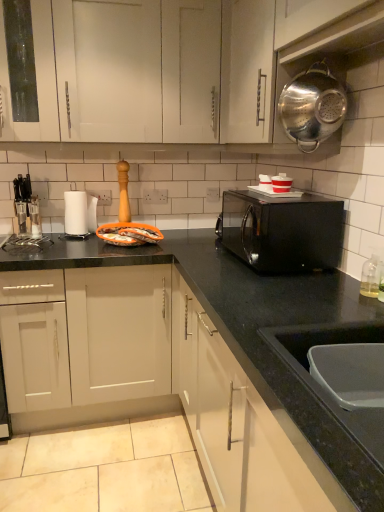
What do you see at coordinates (371, 274) in the screenshot? Image resolution: width=384 pixels, height=512 pixels. I see `clear glass soap dispenser at right` at bounding box center [371, 274].

Measure the distance between point (x=231, y=220) and camera.

Point (x=231, y=220) is 2.03 meters from camera.

At what (x,y) coordinates should I click in order to perform the action: click on polished stainless steel colander at upper right. Please return your answer as a coordinate pair (x, y). The width and height of the screenshot is (384, 512). Looking at the image, I should click on (312, 106).

Which of these two, metallic silver colander at upper right or black glossy microwave at center, is wider?

black glossy microwave at center.

Does metallic silver colander at upper right have a larger size compared to black glossy microwave at center?

Indeed, metallic silver colander at upper right has a larger size compared to black glossy microwave at center.

Could you tell me if clear glass soap dispenser at right is facing white glossy cup at upper center, which is the second appliance from left to right?

No, clear glass soap dispenser at right is not facing towards white glossy cup at upper center, which is the second appliance from left to right.

Is clear glass soap dispenser at right situated inside white glossy cup at upper center, marked as the first appliance in a right-to-left arrangement, or outside?

clear glass soap dispenser at right is not inside white glossy cup at upper center, marked as the first appliance in a right-to-left arrangement, it's outside.

Relative to white glossy cup at upper center, marked as the first appliance in a right-to-left arrangement, is clear glass soap dispenser at right in front or behind?

In the image, clear glass soap dispenser at right appears in front of white glossy cup at upper center, marked as the first appliance in a right-to-left arrangement.

Would you say clear glass soap dispenser at right is a long distance from white glossy cup at upper center, the 2th appliance viewed from the back?

clear glass soap dispenser at right is near white glossy cup at upper center, the 2th appliance viewed from the back, not far away.

Is clear glass soap dispenser at right inside or outside of polished stainless steel colander at upper right?

clear glass soap dispenser at right is spatially situated outside polished stainless steel colander at upper right.

Considering the sizes of objects clear glass soap dispenser at right and polished stainless steel colander at upper right in the image provided, who is thinner, clear glass soap dispenser at right or polished stainless steel colander at upper right?

Thinner between the two is clear glass soap dispenser at right.

Considering the sizes of objects clear glass soap dispenser at right and polished stainless steel colander at upper right in the image provided, who is smaller, clear glass soap dispenser at right or polished stainless steel colander at upper right?

clear glass soap dispenser at right.

Could you tell me if clear glass soap dispenser at right is turned towards polished stainless steel colander at upper right?

No, clear glass soap dispenser at right is not oriented towards polished stainless steel colander at upper right.

From the image's perspective, is polished stainless steel colander at upper right located beneath black glossy microwave at center?

Incorrect, from the image's perspective, polished stainless steel colander at upper right is higher than black glossy microwave at center.

Considering the positions of point (339, 123) and point (286, 210), is point (339, 123) closer or farther from the camera than point (286, 210)?

Point (339, 123) is positioned farther from the camera compared to point (286, 210).

In the scene shown: Is polished stainless steel colander at upper right spatially inside black glossy microwave at center, or outside of it?

polished stainless steel colander at upper right lies outside black glossy microwave at center.

From the image's perspective, between matte black knife block at left, the 2th appliance from the right, and black glossy microwave at center, who is located below?

black glossy microwave at center appears lower in the image.

Is matte black knife block at left, acting as the 2th appliance starting from the front, not within black glossy microwave at center?

matte black knife block at left, acting as the 2th appliance starting from the front, lies outside black glossy microwave at center's area.

Looking at this image, between matte black knife block at left, which appears as the 1th appliance when viewed from the left, and black glossy microwave at center, which one has smaller size?

With smaller size is matte black knife block at left, which appears as the 1th appliance when viewed from the left.

Looking at the image, does metallic silver colander at upper right seem bigger or smaller compared to clear glass soap dispenser at right?

metallic silver colander at upper right is bigger than clear glass soap dispenser at right.

In the scene shown: Which of these two, metallic silver colander at upper right or clear glass soap dispenser at right, stands taller?

With more height is metallic silver colander at upper right.

From a real-world perspective, which object stands above the other?

In real-world perspective, metallic silver colander at upper right is above.

Considering the positions of objects metallic silver colander at upper right and clear glass soap dispenser at right in the image provided, who is more to the left, metallic silver colander at upper right or clear glass soap dispenser at right?

metallic silver colander at upper right.

From a real-world perspective, is white glossy cup at upper center, which is the second appliance from left to right, located beneath black glossy microwave at center?

No, from a real-world perspective, white glossy cup at upper center, which is the second appliance from left to right, is not under black glossy microwave at center.

Which is behind, white glossy cup at upper center, marked as the first appliance in a right-to-left arrangement, or black glossy microwave at center?

white glossy cup at upper center, marked as the first appliance in a right-to-left arrangement.

From the image's perspective, which is below, white glossy cup at upper center, the 1th appliance in the front-to-back sequence, or black glossy microwave at center?

black glossy microwave at center appears lower in the image.

Considering the points (284, 183) and (303, 258), which point is in front, point (284, 183) or point (303, 258)?

The point (303, 258) is closer to the camera.

Identify the location of cabinetry in front of the black glossy microwave at center. The height and width of the screenshot is (512, 384). (283, 54).

Where is `bottle below the white glossy cup at upper center, the 1th appliance in the front-to-back sequence (from a real-world perspective)`? bottle below the white glossy cup at upper center, the 1th appliance in the front-to-back sequence (from a real-world perspective) is located at coordinates (371, 274).

From the image, which object appears to be farther from polished stainless steel colander at upper right, black granite countertop at lower center or matte black knife block at left, the 1th appliance positioned from the back?

The object further to polished stainless steel colander at upper right is matte black knife block at left, the 1th appliance positioned from the back.

Considering their positions, is white glossy cup at upper center, which is the second appliance from left to right, positioned further to black glossy microwave at center than black granite countertop at lower center?

The object further to black glossy microwave at center is white glossy cup at upper center, which is the second appliance from left to right.

Looking at the image, which one is located further to metallic silver colander at upper right, clear glass soap dispenser at right or matte black knife block at left, which appears as the 1th appliance when viewed from the left?

Based on the image, matte black knife block at left, which appears as the 1th appliance when viewed from the left, appears to be further to metallic silver colander at upper right.

When comparing their distances from white glossy cup at upper center, the 1th appliance in the front-to-back sequence, does clear glass soap dispenser at right or matte black knife block at left, the 1th appliance positioned from the back, seem closer?

clear glass soap dispenser at right is closer to white glossy cup at upper center, the 1th appliance in the front-to-back sequence.

From the image, which object appears to be farther from matte black knife block at left, which appears as the 1th appliance when viewed from the left, metallic silver colander at upper right or black glossy microwave at center?

metallic silver colander at upper right is positioned further to the anchor matte black knife block at left, which appears as the 1th appliance when viewed from the left.

Looking at the image, which one is located closer to black granite countertop at lower center, clear glass soap dispenser at right or metallic silver colander at upper right?

Among the two, clear glass soap dispenser at right is located nearer to black granite countertop at lower center.

When comparing their distances from white glossy cup at upper center, marked as the first appliance in a right-to-left arrangement, does matte black knife block at left, the 1th appliance positioned from the back, or black glossy microwave at center seem closer?

black glossy microwave at center is closer to white glossy cup at upper center, marked as the first appliance in a right-to-left arrangement.

Which object lies nearer to the anchor point polished stainless steel colander at upper right, black glossy microwave at center or clear glass soap dispenser at right?

The object closer to polished stainless steel colander at upper right is black glossy microwave at center.

Image resolution: width=384 pixels, height=512 pixels. I want to click on home appliance between black granite countertop at lower center and clear glass soap dispenser at right in the horizontal direction, so click(x=282, y=231).

This screenshot has height=512, width=384. Find the location of `home appliance that lies between metallic silver colander at upper right and clear glass soap dispenser at right from top to bottom`. home appliance that lies between metallic silver colander at upper right and clear glass soap dispenser at right from top to bottom is located at coordinates (282, 231).

You are a GUI agent. You are given a task and a screenshot of the screen. Output one action in this format:
    pyautogui.click(x=<x>, y=<y>)
    Task: Click on the kitchen appliance between metallic silver colander at upper right and black glossy microwave at center in the vertical direction
    
    Given the screenshot: What is the action you would take?
    pyautogui.click(x=312, y=106)

Locate an element on the screen. This screenshot has width=384, height=512. cabinetry between matte black knife block at left, the 1th appliance positioned from the back, and black glossy microwave at center is located at coordinates point(283,54).